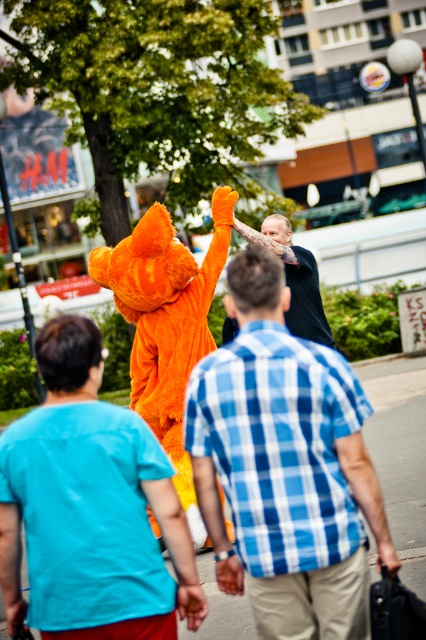
Question: Observing the image, what is the correct spatial positioning of orange plush costume at center in reference to fuzzy orange costume at center?

Choices:
 (A) above
 (B) below

Answer: (B)

Question: In this image, where is blue plaid shirt at center located relative to black textured shirt at center?

Choices:
 (A) below
 (B) above

Answer: (A)

Question: Which point is farther to the camera?

Choices:
 (A) fuzzy orange costume at center
 (B) black textured shirt at center

Answer: (B)

Question: Which object is positioned closest to the black textured shirt at center?

Choices:
 (A) fuzzy orange costume at center
 (B) orange plush costume at center

Answer: (A)

Question: Among these points, which one is nearest to the camera?

Choices:
 (A) (175, 364)
 (B) (330, 384)

Answer: (B)

Question: Does blue plaid shirt at center have a greater width compared to fuzzy orange costume at center?

Choices:
 (A) yes
 (B) no

Answer: (B)